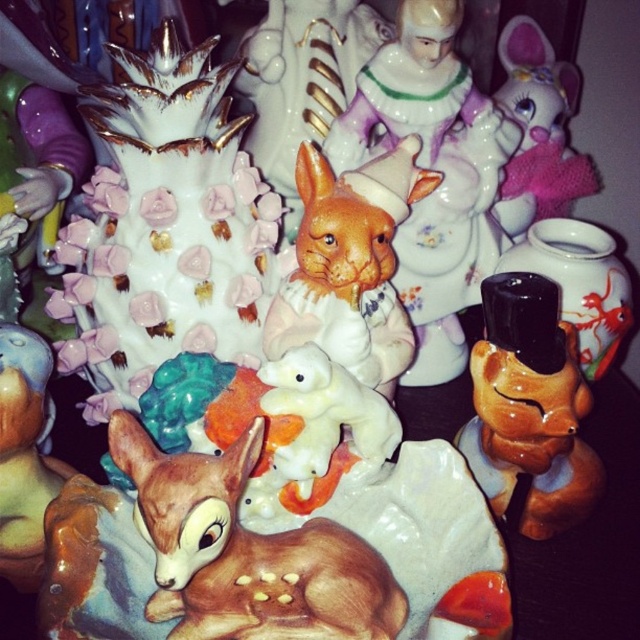
Does matte ceramic rabbit at center appear on the right side of matte ceramic deer at lower left?

Indeed, matte ceramic rabbit at center is positioned on the right side of matte ceramic deer at lower left.

Is matte ceramic rabbit at center shorter than matte ceramic deer at lower left?

Incorrect, matte ceramic rabbit at center's height does not fall short of matte ceramic deer at lower left's.

Which is behind, point (296, 244) or point (33, 552)?

The point (296, 244) is behind.

This screenshot has height=640, width=640. Identify the location of matte ceramic rabbit at center. (349, 264).

Which is below, brown glossy deer at lower left or matte black vase at right?

brown glossy deer at lower left is lower down.

Who is taller, brown glossy deer at lower left or matte black vase at right?

With more height is matte black vase at right.

Is point (221, 481) less distant than point (609, 349)?

Yes, it is.

Locate an element on the screen. brown glossy deer at lower left is located at coordinates (246, 552).

Can you confirm if glossy ceramic fox at right is thinner than matte black vase at right?

No, glossy ceramic fox at right is not thinner than matte black vase at right.

Which is behind, point (484, 291) or point (563, 301)?

The point (563, 301) is more distant.

Where is `glossy ceramic fox at right`? glossy ceramic fox at right is located at coordinates (529, 406).